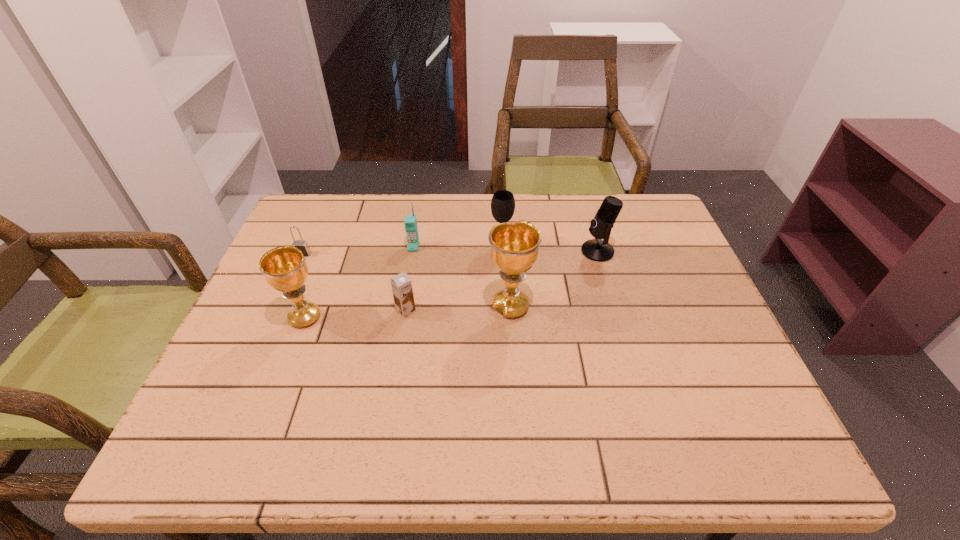
Identify the location of the shorter chalice. (285, 269).

Where is `the second object from left to right`? the second object from left to right is located at coordinates (285, 269).

Identify the location of the taller chalice. (514, 246).

In order to click on the tallest object in this screenshot , I will do `click(514, 246)`.

Image resolution: width=960 pixels, height=540 pixels. Identify the location of the rightmost object. (599, 250).

Where is `cellular telephone`? The image size is (960, 540). cellular telephone is located at coordinates (410, 222).

Locate an element on the screen. The width and height of the screenshot is (960, 540). wineglass is located at coordinates (503, 203).

At what (x,y) coordinates should I click in order to perform the action: click on chocolate milk. Please return your answer as a coordinate pair (x, y). The height and width of the screenshot is (540, 960). Looking at the image, I should click on (401, 284).

Locate an element on the screen. The image size is (960, 540). the leftmost object is located at coordinates (302, 245).

The height and width of the screenshot is (540, 960). Identify the location of the shortest object. (302, 245).